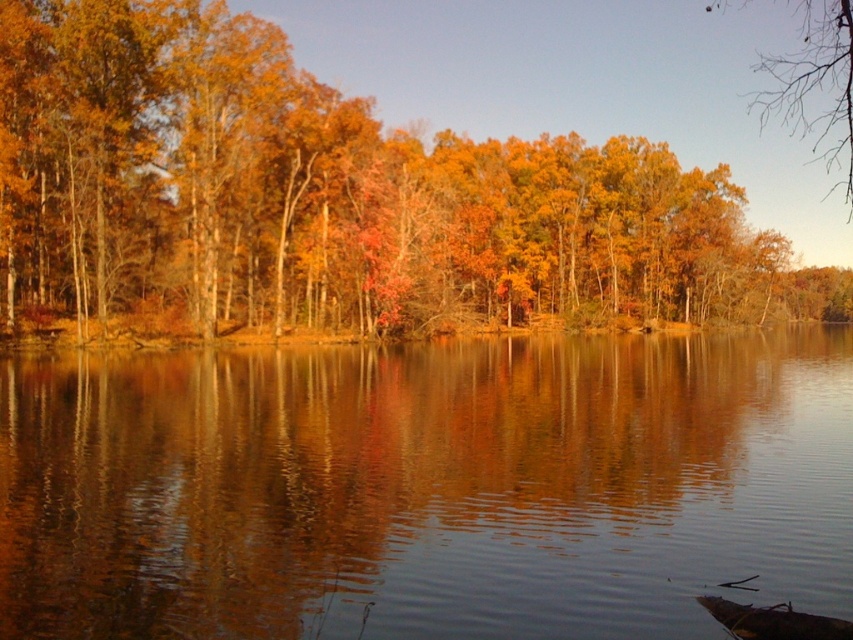
You are standing at the edge of the water and see two points in the scene. The first point is labeled as point (672,579) and the second is point (802,132). Which point is closer to you?

Point (672,579) is in front of point (802,132), so it is closer to you.

You are an artist planning to paint the autumn scene. You want to ensure the shiny reflective water at center and golden leaves at upper center are proportionally accurate. Which object should you paint first to maintain the correct size relationship?

You should paint the golden leaves at upper center first since the shiny reflective water at center is smaller than golden leaves at upper center. By starting with the larger object, you can ensure the smaller one fits appropriately in relation to it.

You are a photographer standing at the lakeside and want to capture a photo of the shiny reflective water at center and the bare branches at upper right. If your camera can focus on objects within 100 meters, will both subjects be in focus?

The shiny reflective water at center is 120.25 meters from the bare branches at upper right. Since the camera can only focus within 100 meters, the distance between them exceeds the focus range, so both subjects cannot be in focus simultaneously.